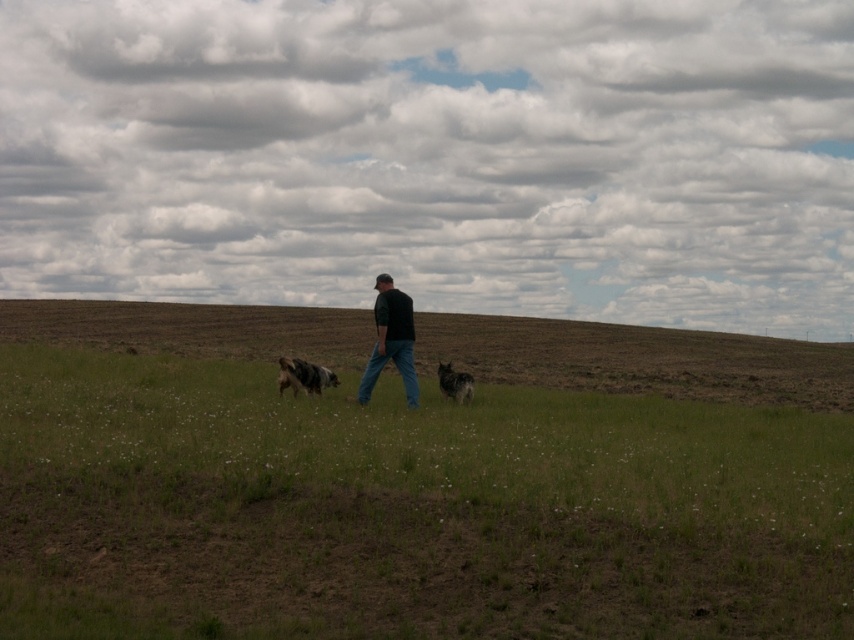
You are standing in the rural scene and need to determine the distance between the green grass at center and the dark green shirt at center. Based on the scene, can you estimate how far apart they are?

The green grass at center is 7.94 feet from the dark green shirt at center.

You are a photographer standing in the grassy field. You want to take a photo of the spotted fur dog at center and the dark gray fur at center. Which dog should you focus on first to ensure both are in clear focus?

The spotted fur dog at center is closer to the viewer than the dark gray fur at center, so focus on the spotted fur dog at center first to ensure both are in clear focus.